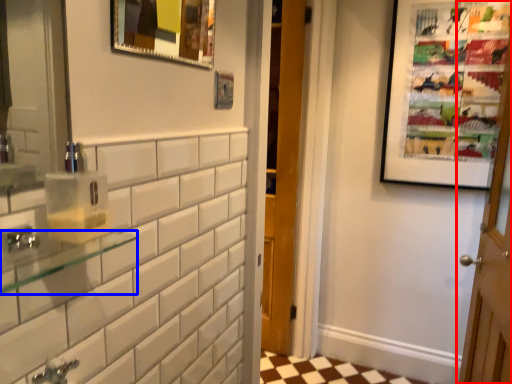
Question: Which point is closer to the camera, door (highlighted by a red box) or balustrade (highlighted by a blue box)?

Choices:
 (A) door
 (B) balustrade

Answer: (B)